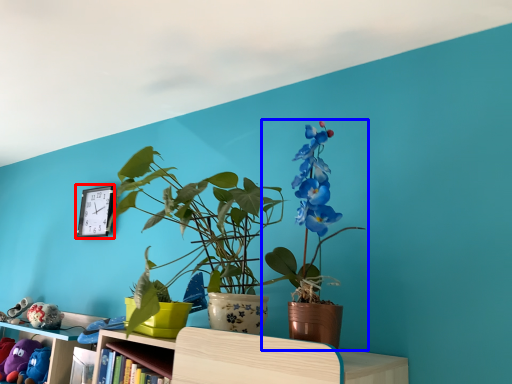
Question: Which of the following is the farthest to the observer, clock (highlighted by a red box) or houseplant (highlighted by a blue box)?

Choices:
 (A) clock
 (B) houseplant

Answer: (A)